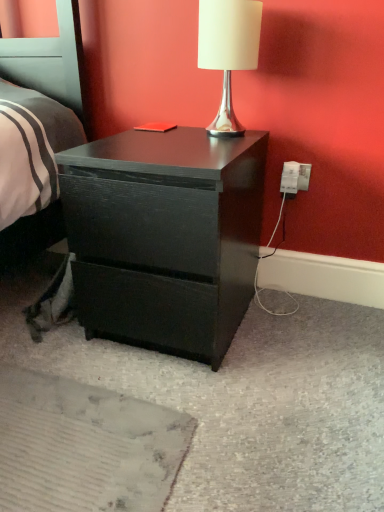
What do you see at coordinates (165, 236) in the screenshot? I see `matte black nightstand at center` at bounding box center [165, 236].

Find the location of `white glossy table lamp at upper center`. white glossy table lamp at upper center is located at coordinates (228, 50).

Which is correct: white glossy table lamp at upper center is inside matte black nightstand at center, or outside of it?

white glossy table lamp at upper center is not inside matte black nightstand at center, it's outside.

Looking at the image, does white glossy table lamp at upper center seem bigger or smaller compared to matte black nightstand at center?

In the image, white glossy table lamp at upper center appears to be smaller than matte black nightstand at center.

Is white glossy table lamp at upper center not near matte black nightstand at center?

Actually, white glossy table lamp at upper center and matte black nightstand at center are a little close together.

From the image's perspective, is white glossy table lamp at upper center above white plastic electric outlet at lower right?

Correct, white glossy table lamp at upper center appears higher than white plastic electric outlet at lower right in the image.

Between white glossy table lamp at upper center and white plastic electric outlet at lower right, which one has more height?

white glossy table lamp at upper center is taller.

Considering the positions of points (253, 64) and (293, 188), is point (253, 64) closer to camera compared to point (293, 188)?

That is True.

In the scene shown: Is white plastic electric outlet at lower right smaller than matte black nightstand at center?

Correct, white plastic electric outlet at lower right occupies less space than matte black nightstand at center.

From a real-world perspective, is white plastic electric outlet at lower right located higher than matte black nightstand at center?

Yes, from a real-world perspective, white plastic electric outlet at lower right is over matte black nightstand at center

The height and width of the screenshot is (512, 384). I want to click on nightstand in front of the white plastic electric outlet at lower right, so click(x=165, y=236).

Are white plastic electric outlet at lower right and matte black nightstand at center beside each other?

white plastic electric outlet at lower right and matte black nightstand at center are clearly separated.

Do you think white plastic electric outlet at lower right is within white glossy table lamp at upper center, or outside of it?

white plastic electric outlet at lower right cannot be found inside white glossy table lamp at upper center.

In the scene shown: Is white plastic electric outlet at lower right turned away from white glossy table lamp at upper center?

That's not correct — white plastic electric outlet at lower right is not looking away from white glossy table lamp at upper center.

How much distance is there between white plastic electric outlet at lower right and white glossy table lamp at upper center?

white plastic electric outlet at lower right is 13.06 inches from white glossy table lamp at upper center.

Who is taller, white plastic electric outlet at lower right or white glossy table lamp at upper center?

white glossy table lamp at upper center is taller.

Who is more distant, matte black nightstand at center or white plastic electric outlet at lower right?

→ white plastic electric outlet at lower right is more distant.

Does point (170, 184) come behind point (304, 178)?

That is False.

Considering the sizes of objects matte black nightstand at center and white plastic electric outlet at lower right in the image provided, who is wider, matte black nightstand at center or white plastic electric outlet at lower right?

matte black nightstand at center is wider.

In terms of height, does matte black nightstand at center look taller or shorter compared to white plastic electric outlet at lower right?

Clearly, matte black nightstand at center is taller compared to white plastic electric outlet at lower right.

Is point (227, 331) behind point (255, 3)?

That is True.

Image resolution: width=384 pixels, height=512 pixels. In order to click on nightstand that appears below the white glossy table lamp at upper center (from a real-world perspective) in this screenshot , I will do `click(165, 236)`.

From a real-world perspective, which is physically below, matte black nightstand at center or white glossy table lamp at upper center?

In real-world perspective, matte black nightstand at center is lower.

You are a GUI agent. You are given a task and a screenshot of the screen. Output one action in this format:
    pyautogui.click(x=<x>, y=<y>)
    Task: Click on the nightstand below the white glossy table lamp at upper center (from the image's perspective)
    The width and height of the screenshot is (384, 512).
    Given the screenshot: What is the action you would take?
    pyautogui.click(x=165, y=236)

The width and height of the screenshot is (384, 512). What are the coordinates of `table lamp in front of the white plastic electric outlet at lower right` in the screenshot? It's located at (228, 50).

Estimate the real-world distances between objects in this image. Which object is closer to white plastic electric outlet at lower right, matte black nightstand at center or white glossy table lamp at upper center?

white glossy table lamp at upper center is closer to white plastic electric outlet at lower right.

From the image, which object appears to be farther from white glossy table lamp at upper center, matte black nightstand at center or white plastic electric outlet at lower right?

matte black nightstand at center lies further to white glossy table lamp at upper center than the other object.

Estimate the real-world distances between objects in this image. Which object is closer to matte black nightstand at center, white glossy table lamp at upper center or white plastic electric outlet at lower right?

Among the two, white glossy table lamp at upper center is located nearer to matte black nightstand at center.

Based on their spatial positions, is white plastic electric outlet at lower right or white glossy table lamp at upper center further from matte black nightstand at center?

white plastic electric outlet at lower right.

Considering their positions, is white plastic electric outlet at lower right positioned closer to white glossy table lamp at upper center than matte black nightstand at center?

white plastic electric outlet at lower right.

Considering their positions, is white glossy table lamp at upper center positioned closer to white plastic electric outlet at lower right than matte black nightstand at center?

Among the two, white glossy table lamp at upper center is located nearer to white plastic electric outlet at lower right.

Image resolution: width=384 pixels, height=512 pixels. Identify the location of table lamp between matte black nightstand at center and white plastic electric outlet at lower right in the front-back direction. (228, 50).